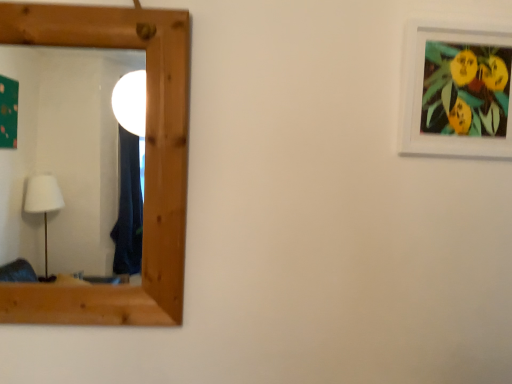
Question: Is white matte picture frame at upper right positioned beyond the bounds of wooden mirror at left?

Choices:
 (A) yes
 (B) no

Answer: (A)

Question: Does white matte picture frame at upper right touch wooden mirror at left?

Choices:
 (A) no
 (B) yes

Answer: (A)

Question: Does white matte picture frame at upper right have a larger size compared to wooden mirror at left?

Choices:
 (A) no
 (B) yes

Answer: (A)

Question: From the image's perspective, does white matte picture frame at upper right appear higher than wooden mirror at left?

Choices:
 (A) yes
 (B) no

Answer: (A)

Question: From the image's perspective, is white matte picture frame at upper right located beneath wooden mirror at left?

Choices:
 (A) no
 (B) yes

Answer: (A)

Question: Does white matte picture frame at upper right have a greater height compared to wooden mirror at left?

Choices:
 (A) no
 (B) yes

Answer: (A)

Question: From a real-world perspective, is wooden mirror at left over white matte picture frame at upper right?

Choices:
 (A) yes
 (B) no

Answer: (B)

Question: Is wooden mirror at left taller than white matte picture frame at upper right?

Choices:
 (A) no
 (B) yes

Answer: (B)

Question: Could white matte picture frame at upper right be considered to be inside wooden mirror at left?

Choices:
 (A) yes
 (B) no

Answer: (B)

Question: Is wooden mirror at left bigger than white matte picture frame at upper right?

Choices:
 (A) yes
 (B) no

Answer: (A)

Question: Would you say wooden mirror at left is outside white matte picture frame at upper right?

Choices:
 (A) no
 (B) yes

Answer: (B)

Question: From a real-world perspective, is wooden mirror at left under white matte picture frame at upper right?

Choices:
 (A) yes
 (B) no

Answer: (A)

Question: Is wooden mirror at left situated inside white matte picture frame at upper right or outside?

Choices:
 (A) outside
 (B) inside

Answer: (A)